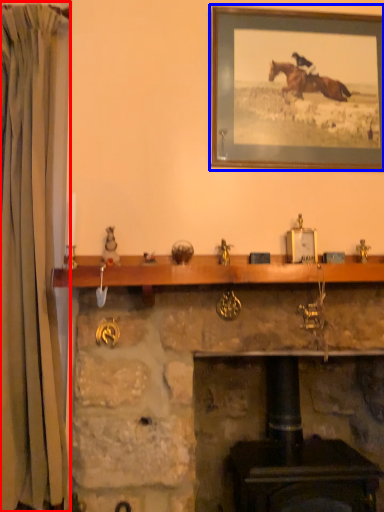
Question: Which point is further to the camera, curtain (highlighted by a red box) or picture frame (highlighted by a blue box)?

Choices:
 (A) curtain
 (B) picture frame

Answer: (B)